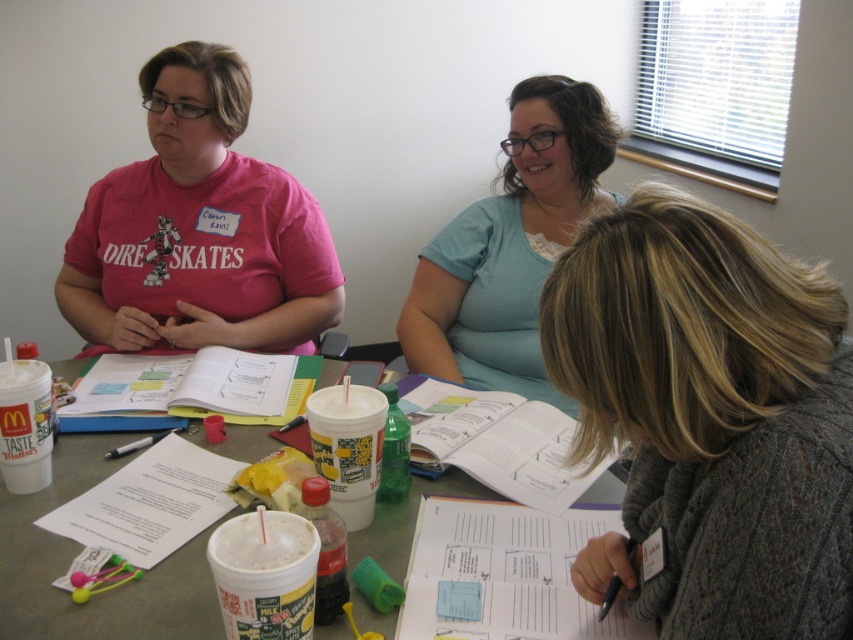
Which is more to the left, knitted gray sweater at lower right or white paper at center?

white paper at center is more to the left.

Does point (831, 444) come closer to viewer compared to point (16, 586)?

Yes, it is in front of point (16, 586).

Where is `knitted gray sweater at lower right`? This screenshot has height=640, width=853. knitted gray sweater at lower right is located at coordinates (711, 419).

Can you confirm if knitted gray sweater at lower right is wider than pink matte shirt at upper left?

In fact, knitted gray sweater at lower right might be narrower than pink matte shirt at upper left.

I want to click on knitted gray sweater at lower right, so click(x=711, y=419).

Between point (480, 202) and point (376, 628), which one is positioned behind?

The point (480, 202) is more distant.

Which is in front, point (440, 369) or point (36, 577)?

Point (36, 577)

Who is more forward, (x=480, y=204) or (x=199, y=611)?

Positioned in front is point (x=199, y=611).

What are the coordinates of `light blue fabric shirt at upper center` in the screenshot? It's located at (509, 244).